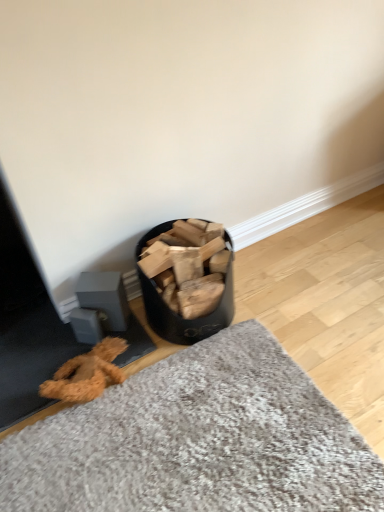
Question: Can you confirm if textured gray mat at lower center is thinner than black matte wood at center?

Choices:
 (A) yes
 (B) no

Answer: (B)

Question: Is textured gray mat at lower center not close to black matte wood at center?

Choices:
 (A) no
 (B) yes

Answer: (A)

Question: Is textured gray mat at lower center wider than black matte wood at center?

Choices:
 (A) no
 (B) yes

Answer: (B)

Question: Is textured gray mat at lower center placed right next to black matte wood at center?

Choices:
 (A) no
 (B) yes

Answer: (A)

Question: Does textured gray mat at lower center have a larger size compared to black matte wood at center?

Choices:
 (A) yes
 (B) no

Answer: (A)

Question: From the image's perspective, is textured gray mat at lower center over black matte wood at center?

Choices:
 (A) no
 (B) yes

Answer: (A)

Question: Does black matte wood at center lie behind textured gray mat at lower center?

Choices:
 (A) no
 (B) yes

Answer: (B)

Question: From the image's perspective, is black matte wood at center on top of textured gray mat at lower center?

Choices:
 (A) no
 (B) yes

Answer: (B)

Question: Can you confirm if black matte wood at center is shorter than textured gray mat at lower center?

Choices:
 (A) yes
 (B) no

Answer: (B)

Question: Does black matte wood at center have a greater height compared to textured gray mat at lower center?

Choices:
 (A) no
 (B) yes

Answer: (B)

Question: Does black matte wood at center appear on the left side of textured gray mat at lower center?

Choices:
 (A) no
 (B) yes

Answer: (B)

Question: Considering the relative sizes of black matte wood at center and textured gray mat at lower center in the image provided, is black matte wood at center wider than textured gray mat at lower center?

Choices:
 (A) no
 (B) yes

Answer: (A)

Question: Is textured gray mat at lower center situated inside black matte wood at center or outside?

Choices:
 (A) outside
 (B) inside

Answer: (A)